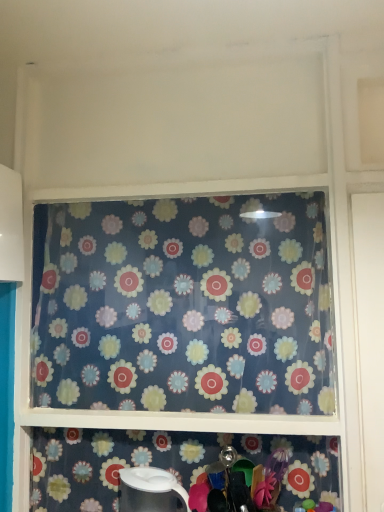
Question: Is point (193, 452) positioned closer to the camera than point (175, 482)?

Choices:
 (A) farther
 (B) closer

Answer: (A)

Question: Visually, is white glossy pitcher at lower center positioned to the left or to the right of white glossy kettle at lower center?

Choices:
 (A) left
 (B) right

Answer: (B)

Question: Estimate the real-world distances between objects in this image. Which object is closer to the white glossy kettle at lower center?

Choices:
 (A) floral-patterned fabric at center
 (B) white glossy pitcher at lower center

Answer: (B)

Question: Which is nearer to the white glossy pitcher at lower center?

Choices:
 (A) white glossy kettle at lower center
 (B) floral-patterned fabric at center

Answer: (A)